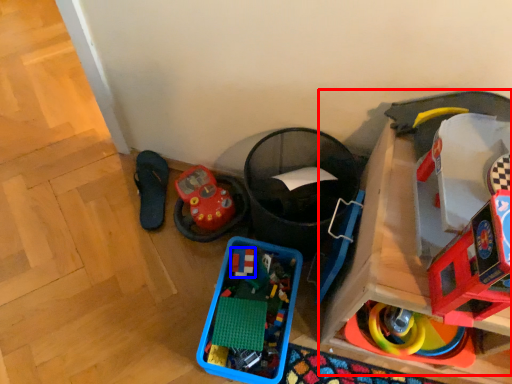
Question: Which object appears farthest to the camera in this image, toy (highlighted by a red box) or toy (highlighted by a blue box)?

Choices:
 (A) toy
 (B) toy

Answer: (B)